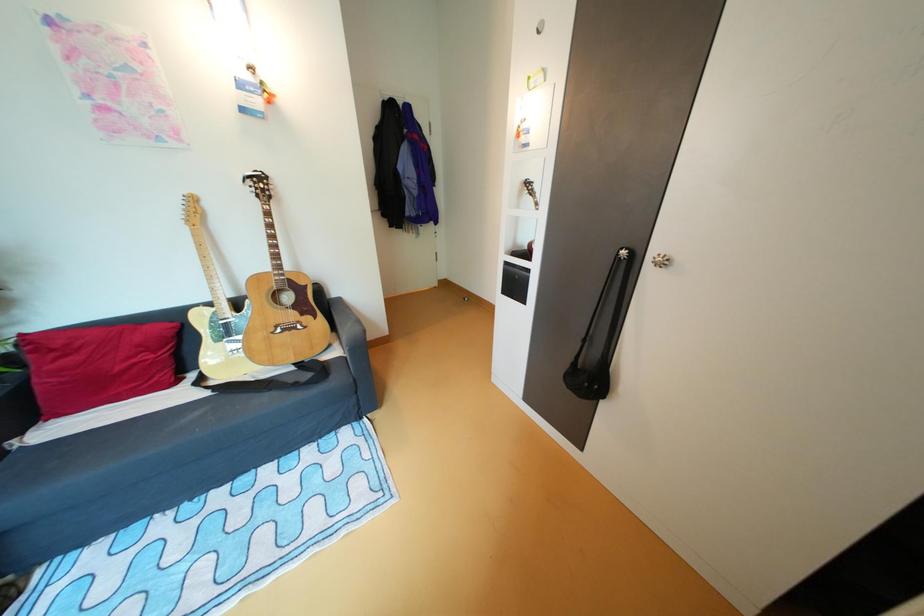
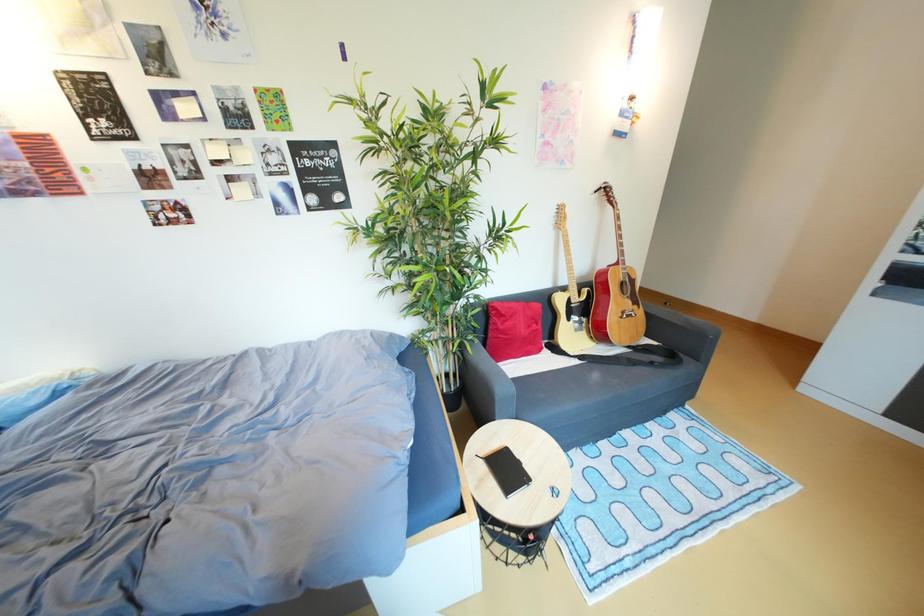
Question: In a continuous first-person perspective shot, in which direction is the camera moving?

Choices:
 (A) Left
 (B) Right
 (C) Forward
 (D) Backward

Answer: (A)